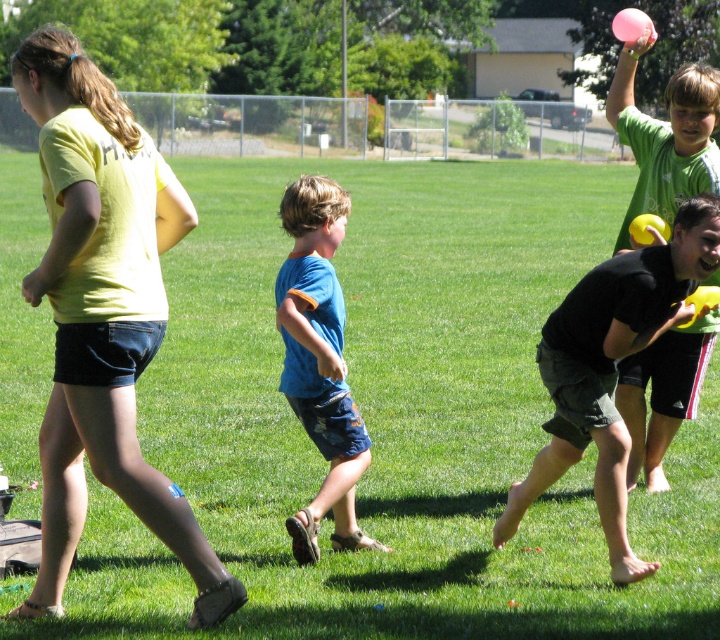
Question: Which of these objects is positioned farthest from the pink rubber ball at upper right?

Choices:
 (A) yellow matte shirt at left
 (B) blue cotton shorts at center

Answer: (A)

Question: Which object appears closest to the camera in this image?

Choices:
 (A) black matte shorts at right
 (B) yellow matte shirt at left

Answer: (B)

Question: Which point appears closest to the camera in this image?

Choices:
 (A) (152, 296)
 (B) (606, 531)

Answer: (A)

Question: Is pink rubber ball at upper right in front of blue cotton shorts at center?

Choices:
 (A) no
 (B) yes

Answer: (A)

Question: Where is yellow matte shirt at left located in relation to pink rubber ball at upper right in the image?

Choices:
 (A) above
 (B) below

Answer: (B)

Question: Does black matte shorts at right appear on the right side of blue cotton shorts at center?

Choices:
 (A) no
 (B) yes

Answer: (B)